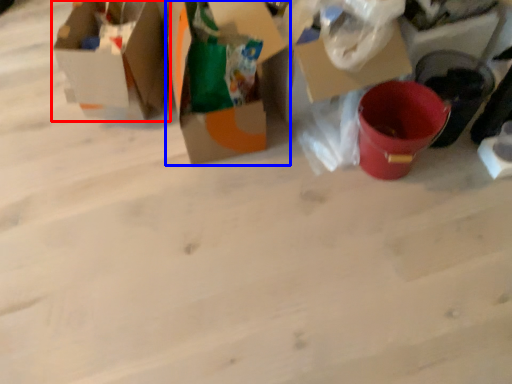
Question: Which of the following is the closest to the observer, box (highlighted by a red box) or box (highlighted by a blue box)?

Choices:
 (A) box
 (B) box

Answer: (B)